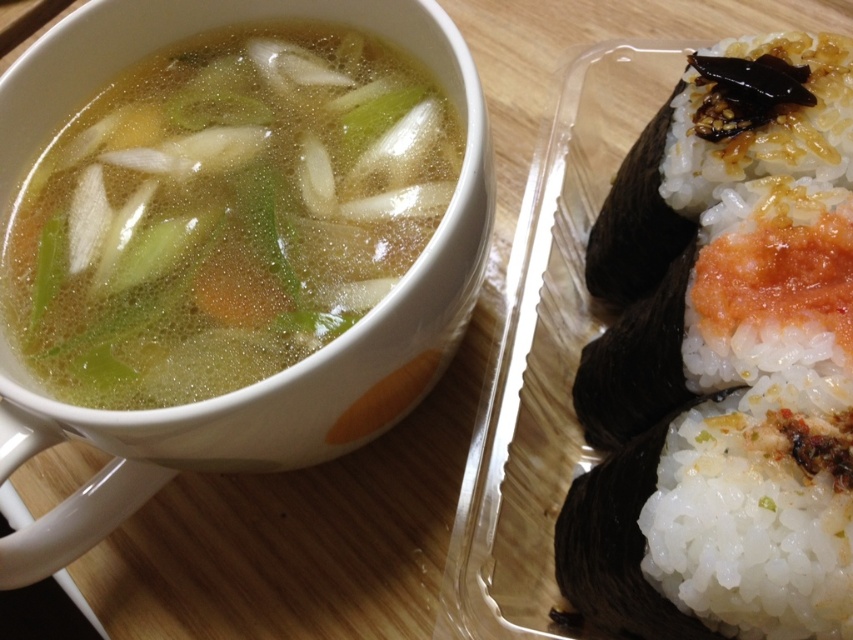
Does translucent broth at upper left have a greater height compared to white rice at upper right?

Correct, translucent broth at upper left is much taller as white rice at upper right.

Who is more distant from viewer, [61,253] or [610,588]?

The point [61,253] is behind.

The width and height of the screenshot is (853, 640). I want to click on translucent broth at upper left, so click(224, 212).

Which is behind, point (828, 116) or point (630, 480)?

Point (828, 116)

Image resolution: width=853 pixels, height=640 pixels. Describe the element at coordinates (723, 364) in the screenshot. I see `white rice with nori at right` at that location.

Where is `white rice with nori at right`? This screenshot has width=853, height=640. white rice with nori at right is located at coordinates (723, 364).

Which is above, white rice with nori at right or translucent broth at upper left?

translucent broth at upper left is above.

Does white rice with nori at right appear on the right side of translucent broth at upper left?

Yes, white rice with nori at right is to the right of translucent broth at upper left.

Locate an element on the screen. Image resolution: width=853 pixels, height=640 pixels. white rice with nori at right is located at coordinates 723,364.